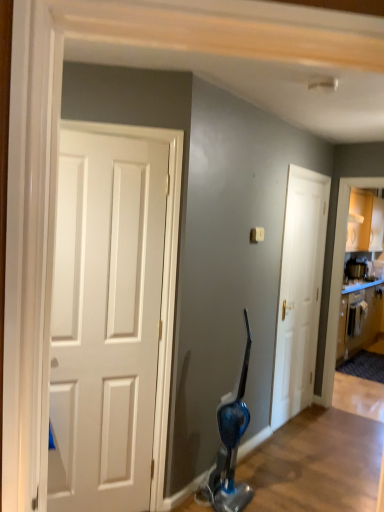
The height and width of the screenshot is (512, 384). In order to click on vacant area on top of white matte door at center (from a real-world perspective) in this screenshot , I will do `click(313, 179)`.